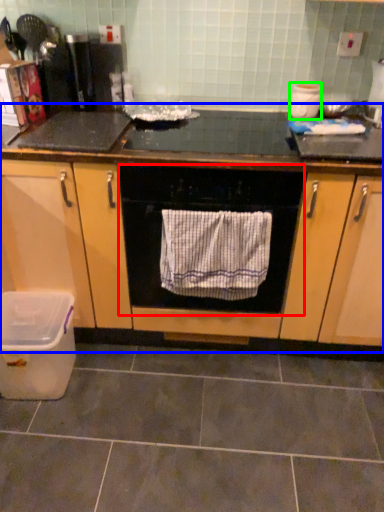
Question: Estimate the real-world distances between objects in this image. Which object is closer to home appliance (highlighted by a red box), cabinetry (highlighted by a blue box) or appliance (highlighted by a green box)?

Choices:
 (A) cabinetry
 (B) appliance

Answer: (A)